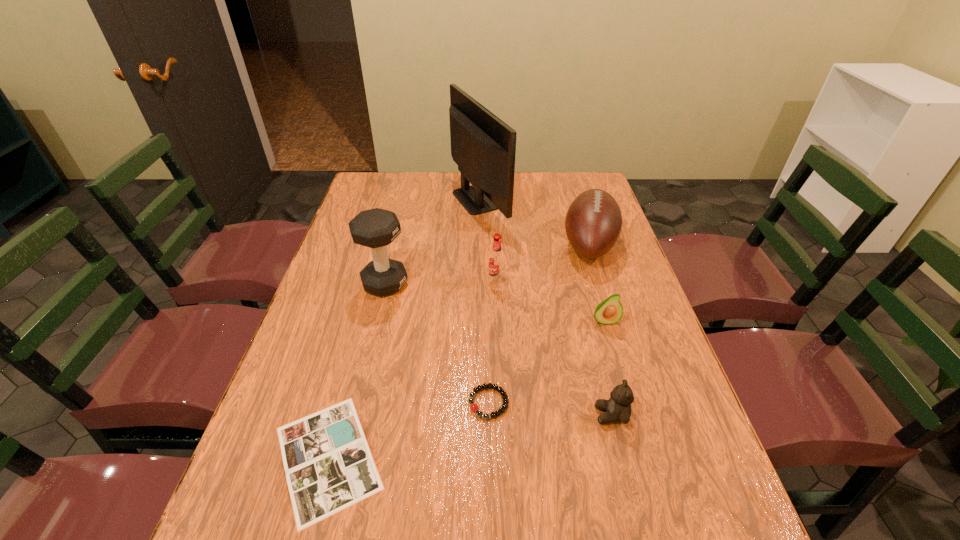
Where is `free point that satisfies the following two spatial constraints: 1. on the front-facing side of the computer monitor; 2. on the front side of the book`? This screenshot has height=540, width=960. free point that satisfies the following two spatial constraints: 1. on the front-facing side of the computer monitor; 2. on the front side of the book is located at coordinates (479, 457).

You are a GUI agent. You are given a task and a screenshot of the screen. Output one action in this format:
    pyautogui.click(x=<x>, y=<y>)
    Task: Click on the vacant space that satisfies the following two spatial constraints: 1. on the back side of the football (American); 2. on the right side of the bracelet
    This screenshot has height=540, width=960.
    Given the screenshot: What is the action you would take?
    pyautogui.click(x=486, y=245)

Where is `vacant space that satisfies the following two spatial constraints: 1. on the back side of the root beer; 2. on the right side of the football (American)`? Image resolution: width=960 pixels, height=540 pixels. vacant space that satisfies the following two spatial constraints: 1. on the back side of the root beer; 2. on the right side of the football (American) is located at coordinates (494, 245).

Identify the location of vacant area in the image that satisfies the following two spatial constraints: 1. on the front-facing side of the bracelet; 2. on the left side of the tallest object. (479, 403).